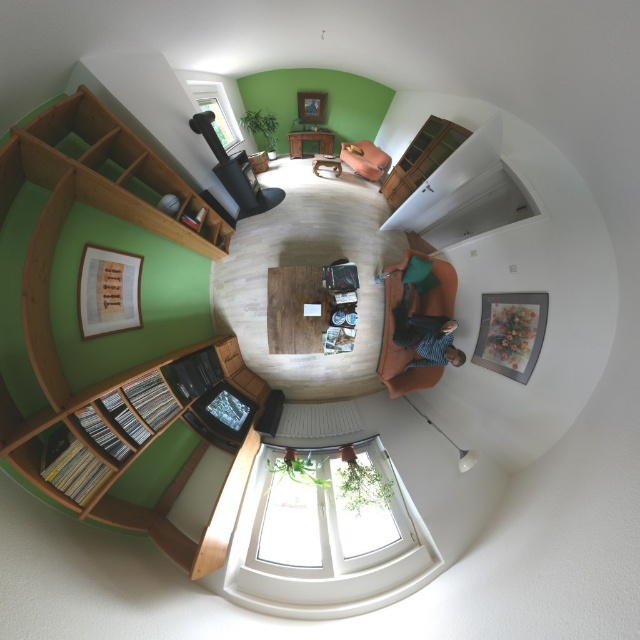
You are sitting on the green fabric couch at center and want to pick up the striped shirt at center from the floor. Can you reach it without moving from the couch?

The striped shirt at center is closer to the viewer than the green fabric couch at center, so yes, you can reach it without moving from the couch.

You are arranging a small plant on the wooden at left and want to place a decorative vase on the wooden bookshelf at upper right. Based on their positions, which object is higher up in the image?

The wooden bookshelf at upper right is higher up than the wooden at left, so the decorative vase placed there would be higher.